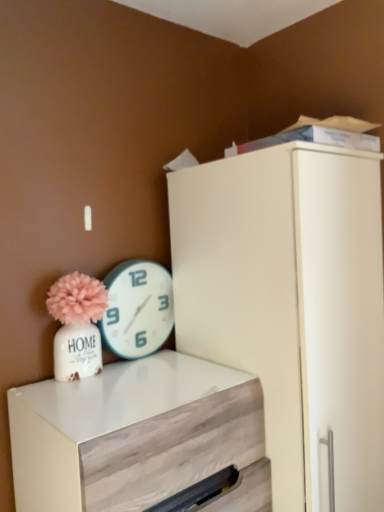
Image resolution: width=384 pixels, height=512 pixels. I want to click on white wood chest of drawers at lower left, so click(x=131, y=433).

The image size is (384, 512). What do you see at coordinates (131, 433) in the screenshot?
I see `white wood chest of drawers at lower left` at bounding box center [131, 433].

Describe the element at coordinates (137, 309) in the screenshot. I see `teal plastic wall clock at upper center` at that location.

You are a GUI agent. You are given a task and a screenshot of the screen. Output one action in this format:
    pyautogui.click(x=<x>, y=<y>)
    Task: Click on the teal plastic wall clock at upper center
    
    Given the screenshot: What is the action you would take?
    pyautogui.click(x=137, y=309)

The width and height of the screenshot is (384, 512). I want to click on white wood chest of drawers at lower left, so click(x=131, y=433).

Would you say teal plastic wall clock at upper center is to the left or to the right of white wood chest of drawers at lower left in the picture?

From the image, it's evident that teal plastic wall clock at upper center is to the left of white wood chest of drawers at lower left.

Is teal plastic wall clock at upper center in front of white wood chest of drawers at lower left?

No, it is not.

Which point is more distant from viewer, (x=139, y=304) or (x=101, y=386)?

The point (x=139, y=304) is behind.

From the picture: From the image's perspective, which is below, teal plastic wall clock at upper center or white wood chest of drawers at lower left?

From the image's view, white wood chest of drawers at lower left is below.

From a real-world perspective, does teal plastic wall clock at upper center sit lower than white wood chest of drawers at lower left?

Incorrect, from a real-world perspective, teal plastic wall clock at upper center is higher than white wood chest of drawers at lower left.

In the scene shown: Looking at their sizes, would you say teal plastic wall clock at upper center is wider or thinner than white wood chest of drawers at lower left?

Considering their sizes, teal plastic wall clock at upper center looks slimmer than white wood chest of drawers at lower left.

In the scene shown: Can you confirm if teal plastic wall clock at upper center is shorter than white wood chest of drawers at lower left?

Correct, teal plastic wall clock at upper center is not as tall as white wood chest of drawers at lower left.

Which of these two, teal plastic wall clock at upper center or white wood chest of drawers at lower left, is bigger?

With larger size is white wood chest of drawers at lower left.

Could white wood chest of drawers at lower left be considered to be inside teal plastic wall clock at upper center?

No, white wood chest of drawers at lower left is not surrounded by teal plastic wall clock at upper center.

Can you see teal plastic wall clock at upper center touching white wood chest of drawers at lower left?

No, teal plastic wall clock at upper center is not beside white wood chest of drawers at lower left.

Could you tell me if teal plastic wall clock at upper center is turned towards white wood chest of drawers at lower left?

No.

Could you measure the distance between teal plastic wall clock at upper center and white wood chest of drawers at lower left?

The distance of teal plastic wall clock at upper center from white wood chest of drawers at lower left is 13.68 inches.

The width and height of the screenshot is (384, 512). I want to click on wall clock above the white wood chest of drawers at lower left (from a real-world perspective), so click(137, 309).

Can you confirm if white wood chest of drawers at lower left is positioned to the left of teal plastic wall clock at upper center?

Incorrect, white wood chest of drawers at lower left is not on the left side of teal plastic wall clock at upper center.

In the scene shown: Is white wood chest of drawers at lower left in front of or behind teal plastic wall clock at upper center in the image?

white wood chest of drawers at lower left is in front of teal plastic wall clock at upper center.

Is point (122, 454) behind point (169, 282)?

No, it is in front of (169, 282).

From the image's perspective, is white wood chest of drawers at lower left on teal plastic wall clock at upper center?

Incorrect, from the image's perspective, white wood chest of drawers at lower left is lower than teal plastic wall clock at upper center.

From a real-world perspective, who is located higher, white wood chest of drawers at lower left or teal plastic wall clock at upper center?

teal plastic wall clock at upper center.

Looking at their sizes, would you say white wood chest of drawers at lower left is wider or thinner than teal plastic wall clock at upper center?

Considering their sizes, white wood chest of drawers at lower left looks broader than teal plastic wall clock at upper center.

Who is taller, white wood chest of drawers at lower left or teal plastic wall clock at upper center?

Standing taller between the two is white wood chest of drawers at lower left.

Considering the relative sizes of white wood chest of drawers at lower left and teal plastic wall clock at upper center in the image provided, is white wood chest of drawers at lower left bigger than teal plastic wall clock at upper center?

Yes, white wood chest of drawers at lower left is bigger than teal plastic wall clock at upper center.

From the picture: Is white wood chest of drawers at lower left spatially inside teal plastic wall clock at upper center, or outside of it?

white wood chest of drawers at lower left is spatially situated outside teal plastic wall clock at upper center.

Would you say white wood chest of drawers at lower left is a long distance from teal plastic wall clock at upper center?

That's not correct — white wood chest of drawers at lower left is a little close to teal plastic wall clock at upper center.

Is white wood chest of drawers at lower left oriented away from teal plastic wall clock at upper center?

No, white wood chest of drawers at lower left is not facing away from teal plastic wall clock at upper center.

Measure the distance between white wood chest of drawers at lower left and teal plastic wall clock at upper center.

white wood chest of drawers at lower left is 13.68 inches from teal plastic wall clock at upper center.

The image size is (384, 512). Find the location of `the chest of drawers that appears below the teal plastic wall clock at upper center (from the image's perspective)`. the chest of drawers that appears below the teal plastic wall clock at upper center (from the image's perspective) is located at coordinates (131, 433).

Find the location of a particular element. This screenshot has height=512, width=384. the chest of drawers located in front of the teal plastic wall clock at upper center is located at coordinates 131,433.

At what (x,y) coordinates should I click in order to perform the action: click on wall clock behind the white wood chest of drawers at lower left. Please return your answer as a coordinate pair (x, y). The image size is (384, 512). Looking at the image, I should click on (137, 309).